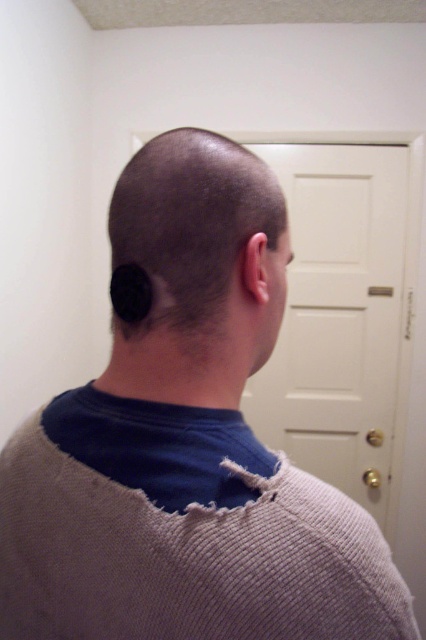
You are a fashion designer analyzing the outfit of the person in the image. Where is the woolen sweater at back located on their body?

The woolen sweater at back is located at point 0.834 on the x axis and 0.425 on the y axis on the person.